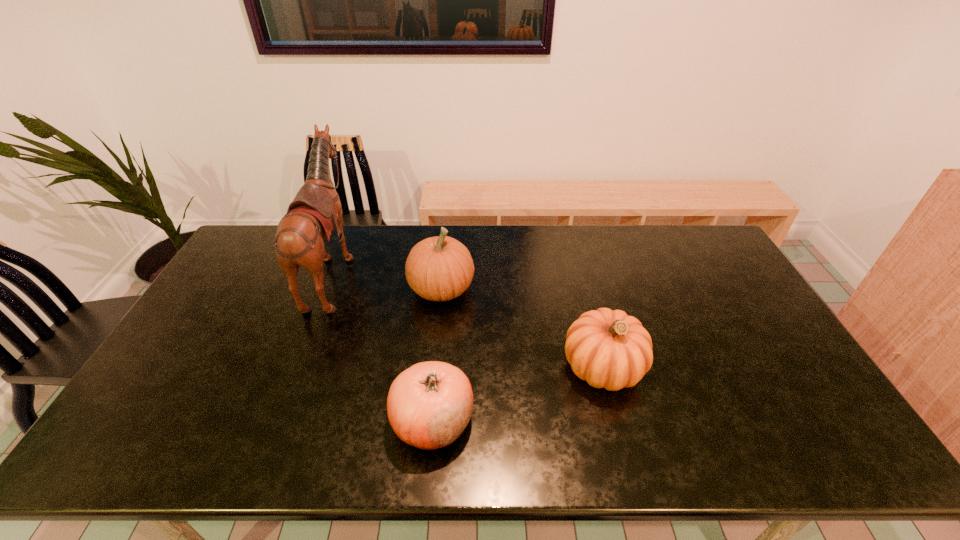
Identify the location of the leftmost object. The height and width of the screenshot is (540, 960). (311, 217).

In order to click on the tallest object in this screenshot , I will do `click(311, 217)`.

Find the location of a particular element. the farthest pumpkin is located at coordinates (440, 268).

Locate an element on the screen. This screenshot has height=540, width=960. the rightmost object is located at coordinates (607, 348).

Where is `vacant area situated on the back of the leftmost object`? The height and width of the screenshot is (540, 960). vacant area situated on the back of the leftmost object is located at coordinates (384, 271).

Identify the location of free spot located on the stem of the farthest pumpkin. The width and height of the screenshot is (960, 540). (502, 289).

Find the location of `blank space located on the right of the rightmost object`. blank space located on the right of the rightmost object is located at coordinates (691, 367).

Locate an element on the screen. object that is at the far edge is located at coordinates (311, 217).

This screenshot has width=960, height=540. I want to click on object situated at the near edge, so click(429, 405).

I want to click on vacant region at the far edge of the desktop, so click(551, 231).